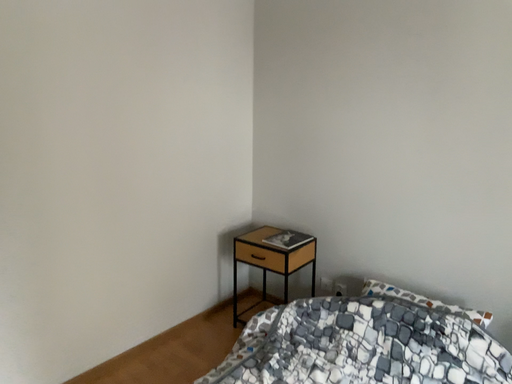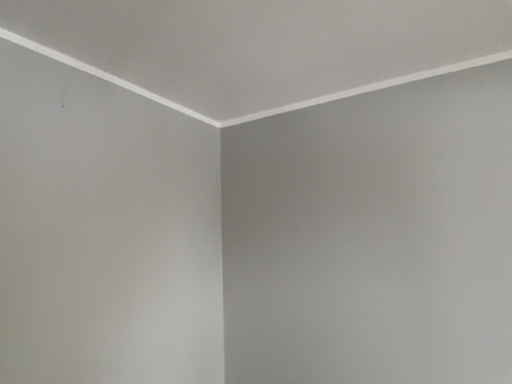
Question: Which way did the camera rotate in the video?

Choices:
 (A) rotated upward
 (B) rotated downward

Answer: (A)